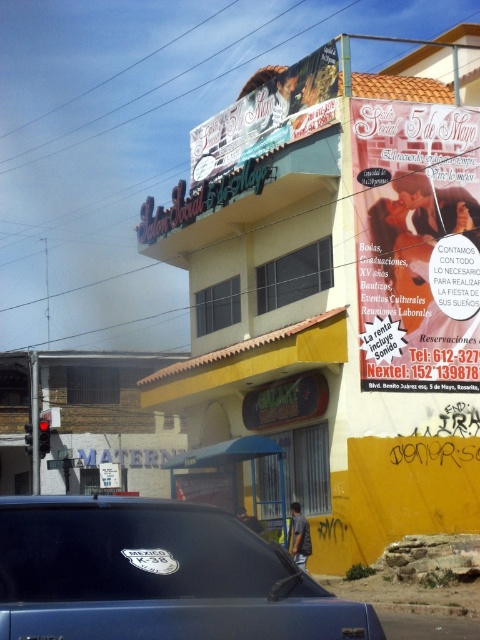
Question: Which point is farther from the camera taking this photo?

Choices:
 (A) (230, 564)
 (B) (46, 636)
 (C) (444, 116)

Answer: (C)

Question: Does matte pink sign at upper right have a smaller size compared to matte plastic signboard at upper center?

Choices:
 (A) yes
 (B) no

Answer: (A)

Question: Which point is closer to the camera?

Choices:
 (A) (325, 72)
 (B) (383, 218)

Answer: (B)

Question: Is matte plastic signboard at upper center positioned at the back of white plastic license plate at lower center?

Choices:
 (A) no
 (B) yes

Answer: (B)

Question: Can you confirm if matte pink sign at upper right is smaller than white plastic license plate at lower center?

Choices:
 (A) no
 (B) yes

Answer: (A)

Question: Which point appears closest to the camera in this image?

Choices:
 (A) (37, 636)
 (B) (253, 604)
 (C) (420, 257)

Answer: (A)